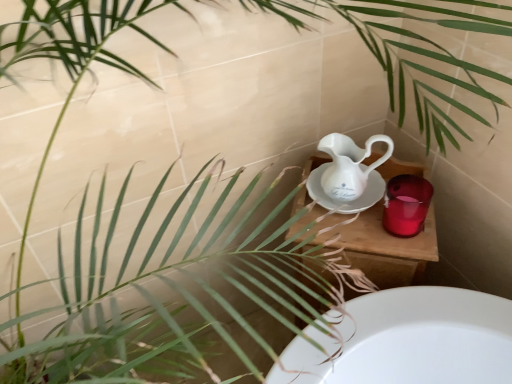
Question: From the image's perspective, is glossy ceramic mug at upper right under wooden table at center?

Choices:
 (A) no
 (B) yes

Answer: (A)

Question: Is glossy ceramic mug at upper right positioned far away from wooden table at center?

Choices:
 (A) yes
 (B) no

Answer: (B)

Question: Are glossy ceramic mug at upper right and wooden table at center beside each other?

Choices:
 (A) yes
 (B) no

Answer: (A)

Question: Is glossy ceramic mug at upper right wider than wooden table at center?

Choices:
 (A) yes
 (B) no

Answer: (B)

Question: From a real-world perspective, is glossy ceramic mug at upper right over wooden table at center?

Choices:
 (A) yes
 (B) no

Answer: (A)

Question: Is wooden table at center at the back of glossy ceramic mug at upper right?

Choices:
 (A) no
 (B) yes

Answer: (A)

Question: Is there a large distance between wooden table at center and white porcelain jug at center?

Choices:
 (A) no
 (B) yes

Answer: (A)

Question: From a real-world perspective, is wooden table at center under white porcelain jug at center?

Choices:
 (A) no
 (B) yes

Answer: (B)

Question: Is wooden table at center aimed at white porcelain jug at center?

Choices:
 (A) no
 (B) yes

Answer: (A)

Question: Is wooden table at center looking in the opposite direction of white porcelain jug at center?

Choices:
 (A) yes
 (B) no

Answer: (B)

Question: Considering the relative positions of wooden table at center and white porcelain jug at center in the image provided, is wooden table at center to the left of white porcelain jug at center from the viewer's perspective?

Choices:
 (A) no
 (B) yes

Answer: (A)

Question: Can you confirm if wooden table at center is shorter than white porcelain jug at center?

Choices:
 (A) no
 (B) yes

Answer: (A)

Question: Can you confirm if wooden table at center is thinner than glossy ceramic mug at upper right?

Choices:
 (A) yes
 (B) no

Answer: (B)